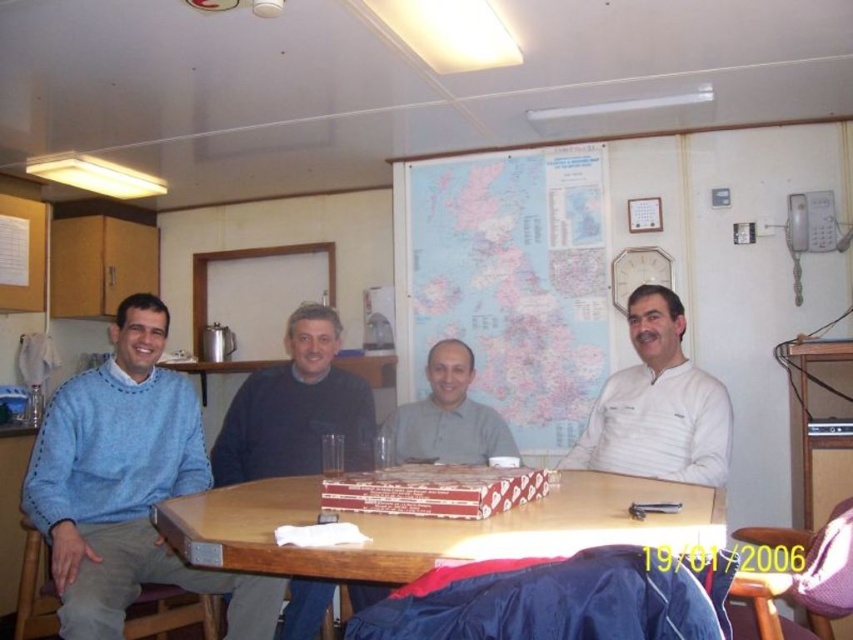
You are a guest at this gathering and want to place your phone on the wooden table at center without it falling off. Considering the dark blue sweater at center is already on the table, where should you place your phone?

The wooden table at center is below dark blue sweater at center, so placing the phone next to the dark blue sweater at center on the table would ensure it stays on the table and doesn

You are standing in the room and want to reach both the point at coordinates (x=219, y=557) and the point at (x=344, y=396). Which point is closer to you?

The point at coordinates (x=219, y=557) is closer to you than the point at (x=344, y=396).

You are standing in the room and want to place a small plate on the wooden table at center. However, you notice the light brown shirt at center is in the way. Can you place the plate directly on the table without moving the shirt?

The wooden table at center is positioned under the light brown shirt at center, so you cannot place the plate directly on the table without moving the shirt.